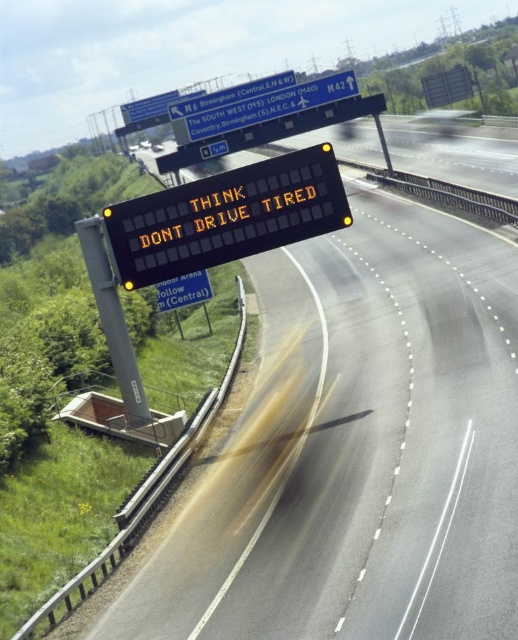
Looking at this image, you are a truck driver approaching the highway and see the black electronic display at upper center and the yellow reflective electronic display at upper center. Which display is shorter in height?

The black electronic display at upper center is shorter in height compared to the yellow reflective electronic display at upper center.

You are a driver approaching the highway and notice a yellow reflective plastic sign at upper center. Where exactly is this sign positioned relative to the electronic message board?

The yellow reflective plastic sign at upper center is located at point coordinates of (270, 106), which places it slightly to the left and above the electronic message board mounted on the tall pole.